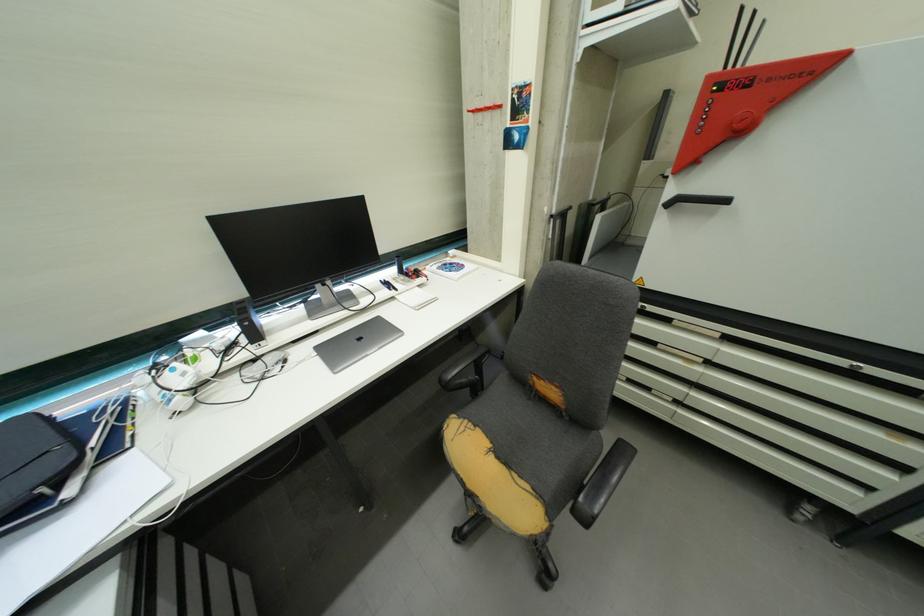
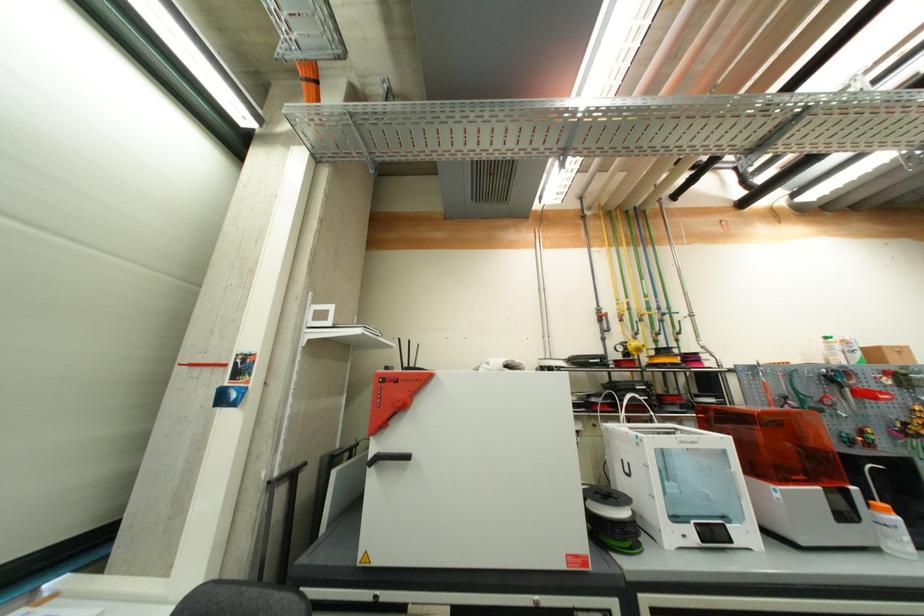
First-person continuous shooting, in which direction is the camera rotating?

The camera's rotation is toward right-up.